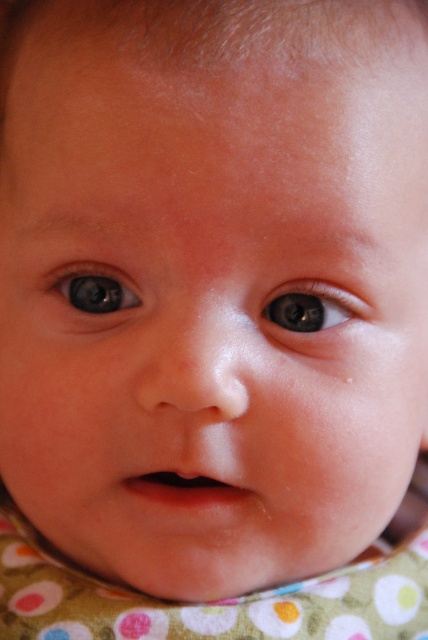
Between point (293, 330) and point (110, 301), which one is positioned in front?

Point (293, 330) is in front.

Can you confirm if brown glossy eye at center is bigger than blue glossy eye at center?

No.

Is point (318, 284) less distant than point (112, 317)?

Yes, it is.

You are a GUI agent. You are given a task and a screenshot of the screen. Output one action in this format:
    pyautogui.click(x=<x>, y=<y>)
    Task: Click on the brown glossy eye at center
    This screenshot has height=640, width=428.
    Given the screenshot: What is the action you would take?
    pyautogui.click(x=312, y=305)